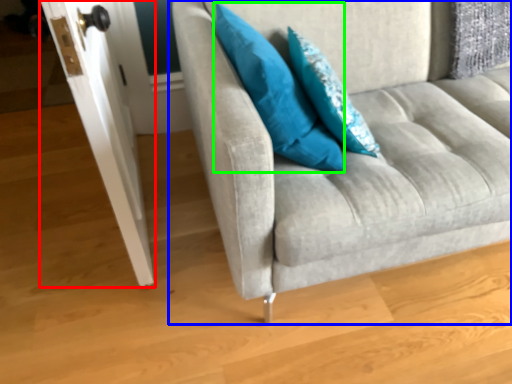
Question: Considering the real-world distances, which object is farthest from door (highlighted by a red box)? studio couch (highlighted by a blue box) or pillow (highlighted by a green box)?

Choices:
 (A) studio couch
 (B) pillow

Answer: (A)